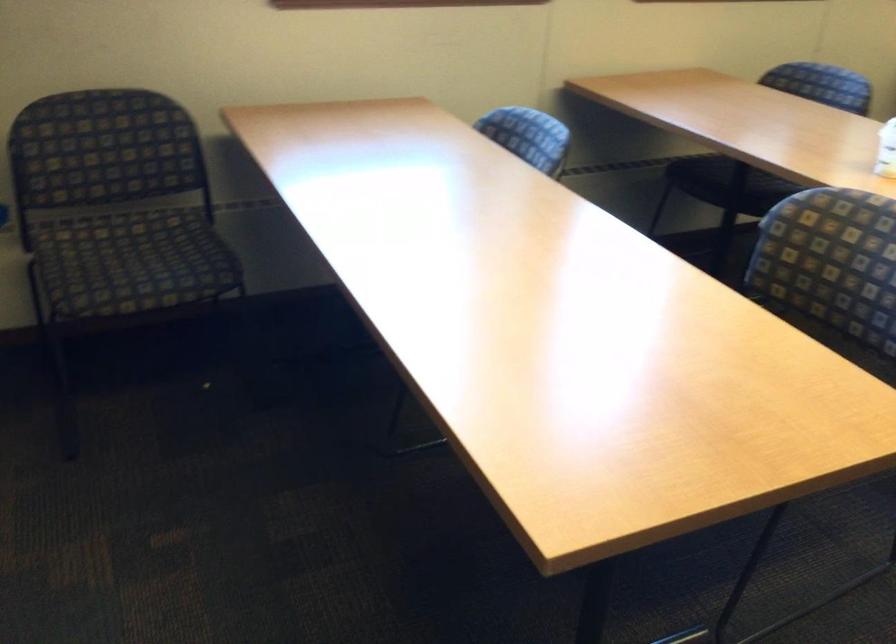
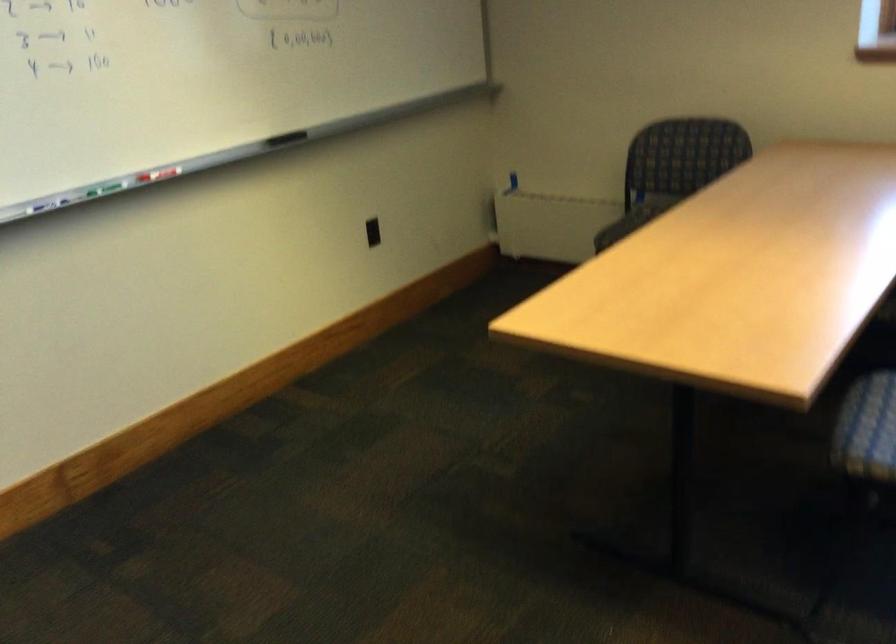
Find the pixel in the second image that matches pixel 657 563 in the first image.

(866, 576)